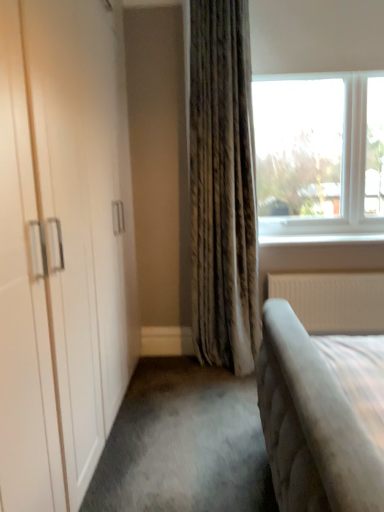
Question: Is white glossy window sill at upper right at the back of white textured radiator at lower right?

Choices:
 (A) no
 (B) yes

Answer: (A)

Question: Is the depth of white textured radiator at lower right less than that of white glossy window sill at upper right?

Choices:
 (A) no
 (B) yes

Answer: (B)

Question: Is white textured radiator at lower right at the left side of white glossy window sill at upper right?

Choices:
 (A) yes
 (B) no

Answer: (B)

Question: Is white textured radiator at lower right directly adjacent to white glossy window sill at upper right?

Choices:
 (A) no
 (B) yes

Answer: (A)

Question: Can you confirm if white textured radiator at lower right is shorter than white glossy window sill at upper right?

Choices:
 (A) yes
 (B) no

Answer: (B)

Question: From the image's perspective, is white glossy window sill at upper right above or below white textured radiator at lower right?

Choices:
 (A) below
 (B) above

Answer: (B)

Question: Is point tap(370, 237) positioned closer to the camera than point tap(339, 301)?

Choices:
 (A) farther
 (B) closer

Answer: (B)

Question: Based on their sizes in the image, would you say white glossy window sill at upper right is bigger or smaller than white textured radiator at lower right?

Choices:
 (A) big
 (B) small

Answer: (B)

Question: From a real-world perspective, is white glossy window sill at upper right positioned above or below white textured radiator at lower right?

Choices:
 (A) above
 (B) below

Answer: (A)

Question: Is point (324, 305) closer or farther from the camera than point (258, 96)?

Choices:
 (A) farther
 (B) closer

Answer: (B)

Question: Is white textured radiator at lower right bigger or smaller than clear glass window at upper right?

Choices:
 (A) small
 (B) big

Answer: (A)

Question: In the image, is white textured radiator at lower right on the left side or the right side of clear glass window at upper right?

Choices:
 (A) right
 (B) left

Answer: (A)

Question: Is white textured radiator at lower right inside or outside of clear glass window at upper right?

Choices:
 (A) inside
 (B) outside

Answer: (B)

Question: Is white textured radiator at lower right inside or outside of white glossy window sill at upper right?

Choices:
 (A) outside
 (B) inside

Answer: (A)

Question: Is point (311, 301) positioned closer to the camera than point (349, 241)?

Choices:
 (A) farther
 (B) closer

Answer: (A)